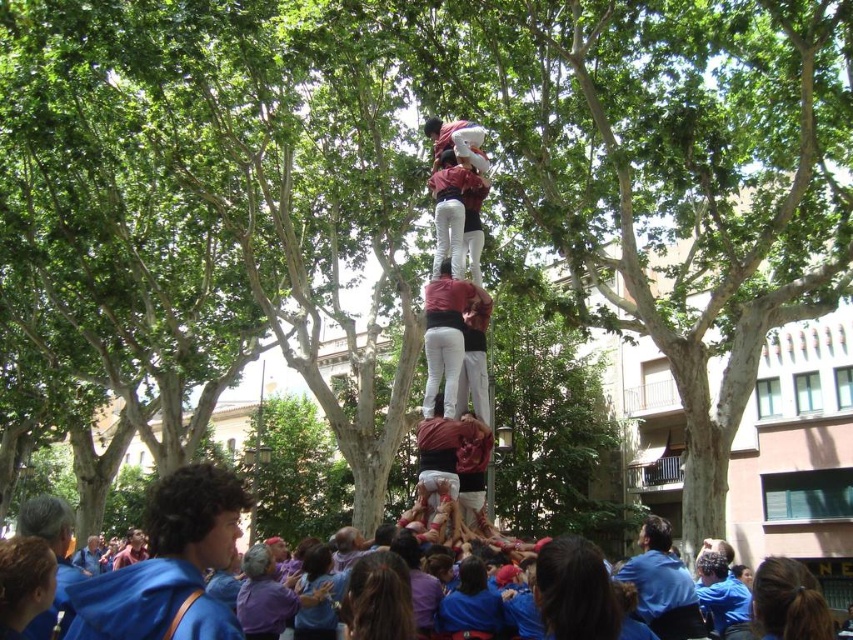
Question: Does blue fabric crowd at lower center appear on the right side of matte red shirt at center?

Choices:
 (A) no
 (B) yes

Answer: (B)

Question: Which object is closer to the camera taking this photo?

Choices:
 (A) smooth white pants at center
 (B) blue fabric crowd at lower center

Answer: (B)

Question: Among these points, which one is nearest to the camera?

Choices:
 (A) pos(218,564)
 (B) pos(473,182)
 (C) pos(445,380)

Answer: (A)

Question: Does blue fabric crowd at lower center have a greater width compared to matte red shirt at center?

Choices:
 (A) yes
 (B) no

Answer: (A)

Question: Which point is farther from the camera taking this photo?

Choices:
 (A) (450, 381)
 (B) (456, 205)
 (C) (212, 497)

Answer: (B)

Question: Can you confirm if smooth white pants at center is bigger than matte red shirt at center?

Choices:
 (A) no
 (B) yes

Answer: (B)